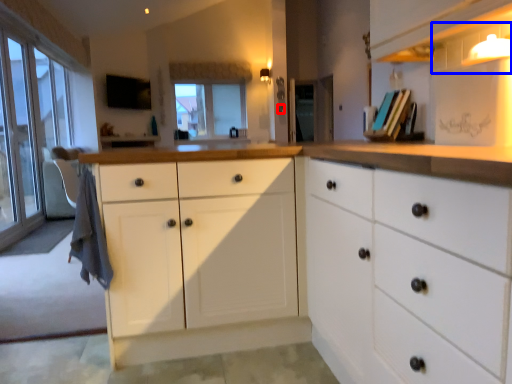
Question: Which object is further to the camera taking this photo, knob (highlighted by a red box) or shelf (highlighted by a blue box)?

Choices:
 (A) knob
 (B) shelf

Answer: (A)